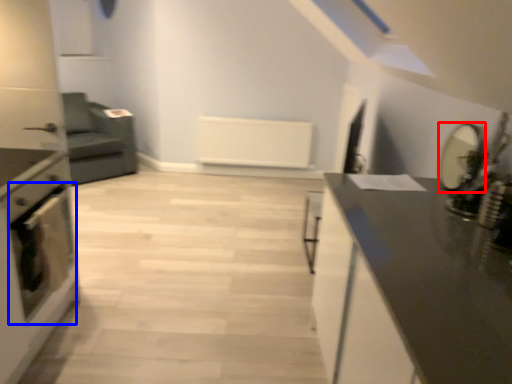
Question: Among these objects, which one is nearest to the camera, appliance (highlighted by a red box) or oven (highlighted by a blue box)?

Choices:
 (A) appliance
 (B) oven

Answer: (A)